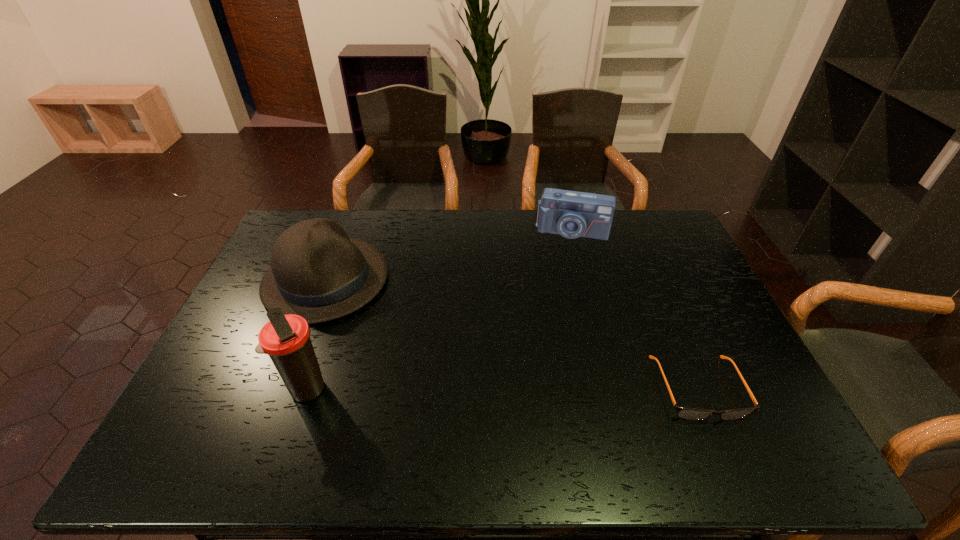
Find the location of a particular element. The height and width of the screenshot is (540, 960). unoccupied area between the spectacles and the third tallest object is located at coordinates (635, 309).

Where is `unoccupied position between the third tallest object and the spectacles`? Image resolution: width=960 pixels, height=540 pixels. unoccupied position between the third tallest object and the spectacles is located at coordinates (635, 309).

Where is `free point between the third tallest object and the spectacles`? free point between the third tallest object and the spectacles is located at coordinates (635, 309).

This screenshot has height=540, width=960. In order to click on empty space that is in between the third shortest object and the thermos bottle in this screenshot , I will do `click(317, 335)`.

Where is `empty space that is in between the shortest object and the bowler hat`? empty space that is in between the shortest object and the bowler hat is located at coordinates (512, 334).

The height and width of the screenshot is (540, 960). I want to click on the second closest object to the thermos bottle, so click(x=572, y=214).

The image size is (960, 540). Find the location of `the second closest object relative to the tallest object`. the second closest object relative to the tallest object is located at coordinates (572, 214).

At what (x,y) coordinates should I click in order to perform the action: click on vacant space that satisfies the following two spatial constraints: 1. on the front side of the thermos bottle; 2. on the left side of the third nearest object. Please return your answer as a coordinate pair (x, y). Looking at the image, I should click on (284, 389).